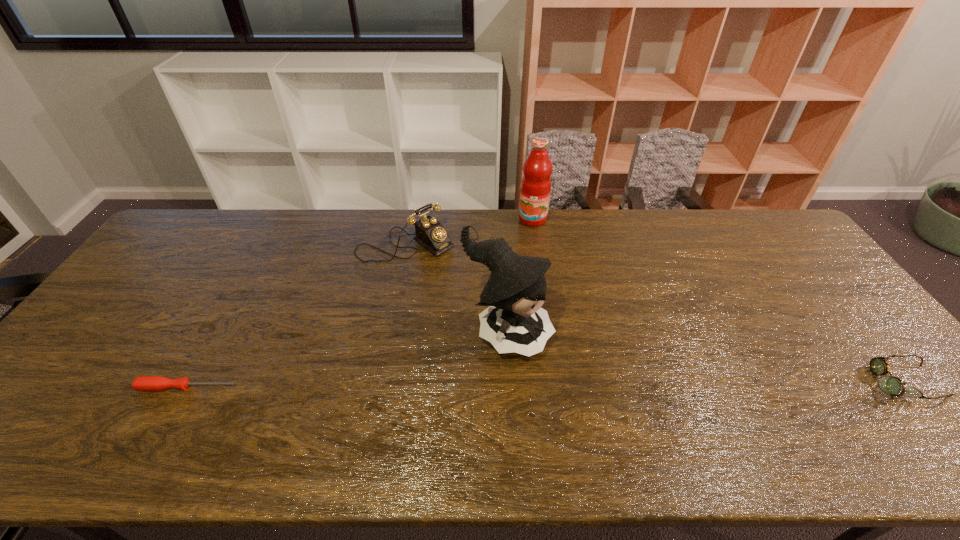
Find the location of a particular element. vacant region that satisfies the following two spatial constraints: 1. on the front side of the second object from left to right; 2. on the left side of the doll is located at coordinates (388, 334).

Locate an element on the screen. Image resolution: width=960 pixels, height=540 pixels. blank space that satisfies the following two spatial constraints: 1. on the front side of the rightmost object; 2. on the front-facing side of the fruit juice is located at coordinates (557, 382).

The image size is (960, 540). What are the coordinates of `vacant space that satisfies the following two spatial constraints: 1. on the front side of the spectacles; 2. on the front-facing side of the third shortest object` in the screenshot? It's located at (379, 382).

The image size is (960, 540). I want to click on vacant space that satisfies the following two spatial constraints: 1. on the front side of the third tallest object; 2. on the front-facing side of the second shortest object, so click(379, 382).